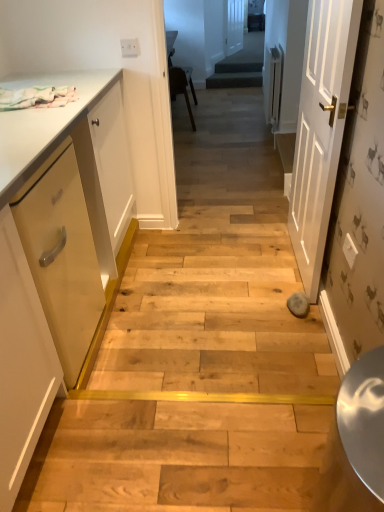
Locate an element on the screen. The height and width of the screenshot is (512, 384). free point to the left of white painted wood door at center right, the 1th door viewed from the front is located at coordinates (236, 264).